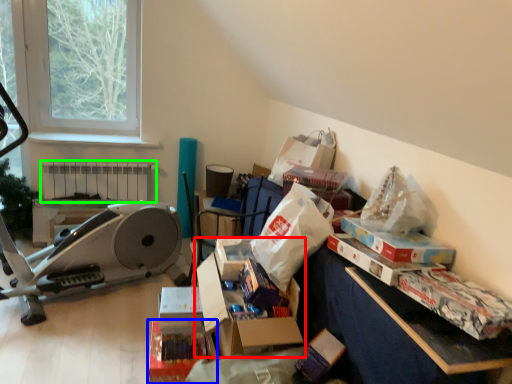
Question: Which object is the closest to the storage box (highlighted by a red box)? Choose among these: storage box (highlighted by a blue box) or radiator (highlighted by a green box).

Choices:
 (A) storage box
 (B) radiator

Answer: (A)